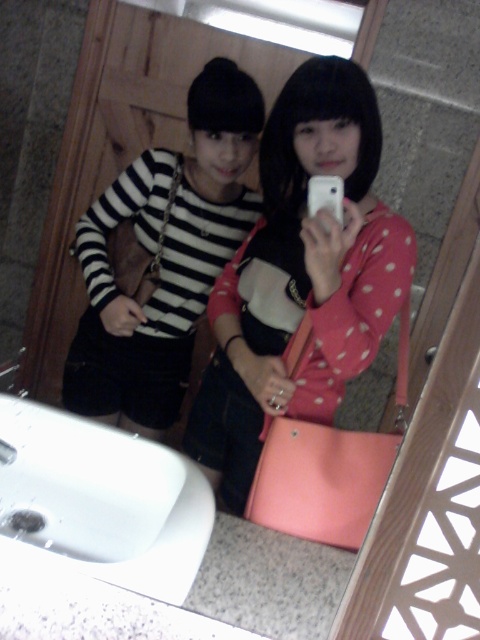
Question: Among these points, which one is farthest from the camera?

Choices:
 (A) (98, 234)
 (B) (215, 442)
 (C) (336, 202)
 (D) (126, 552)

Answer: (A)

Question: Is striped fabric shirt at center further to camera compared to white glossy sink at lower left?

Choices:
 (A) no
 (B) yes

Answer: (B)

Question: Estimate the real-world distances between objects in this image. Which object is closer to the pink matte handbag at center?

Choices:
 (A) striped fabric shirt at center
 (B) white matte smartphone at center

Answer: (B)

Question: Does pink matte handbag at center have a larger size compared to striped fabric shirt at center?

Choices:
 (A) no
 (B) yes

Answer: (B)

Question: Can you confirm if pink matte handbag at center is thinner than striped fabric shirt at center?

Choices:
 (A) no
 (B) yes

Answer: (B)

Question: Which of the following is the closest to the observer?

Choices:
 (A) pyautogui.click(x=320, y=208)
 (B) pyautogui.click(x=240, y=92)

Answer: (A)